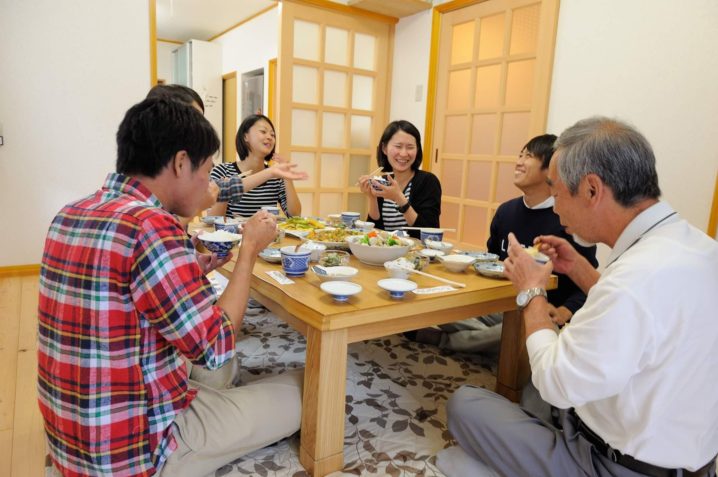
Find the location of a particular element. The height and width of the screenshot is (477, 718). light switch on wall is located at coordinates (418, 93).